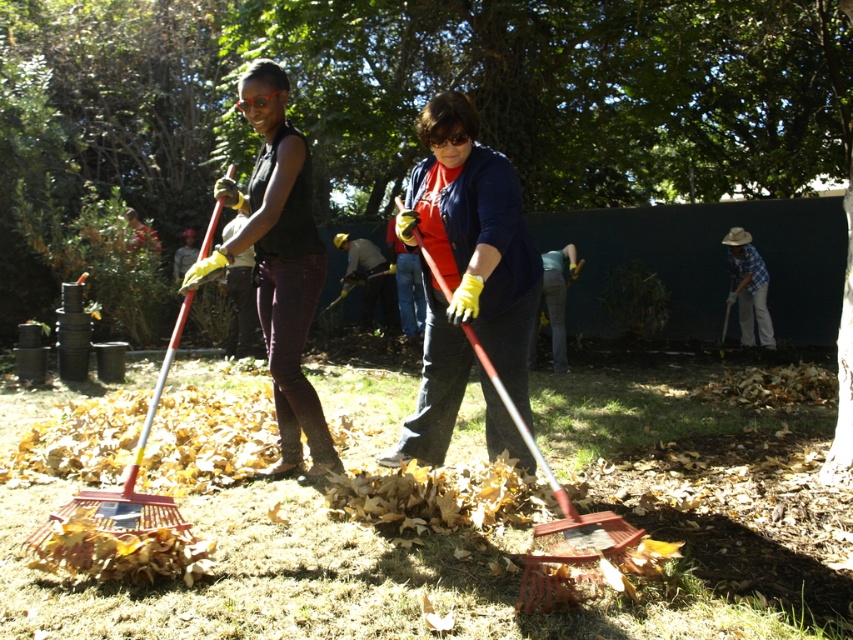
Between point (306, 291) and point (592, 534), which one is positioned in front?

Point (592, 534) is more forward.

Locate an element on the screen. The height and width of the screenshot is (640, 853). matte black shirt at center is located at coordinates (279, 262).

Can you confirm if red plastic shovel at center is smaller than dark gray fabric shirt at center?

Yes, red plastic shovel at center is smaller than dark gray fabric shirt at center.

How much distance is there between red plastic shovel at center and dark gray fabric shirt at center?

9.23 meters

What do you see at coordinates (543, 461) in the screenshot? I see `red plastic shovel at center` at bounding box center [543, 461].

The height and width of the screenshot is (640, 853). I want to click on red plastic shovel at center, so click(543, 461).

Who is more distant from viewer, (312, 221) or (753, 262)?

Positioned behind is point (753, 262).

Can you confirm if matte black shirt at center is positioned below blue plaid shirt at lower right?

Yes, matte black shirt at center is below blue plaid shirt at lower right.

Is point (289, 232) farther from camera compared to point (740, 308)?

No, (289, 232) is in front of (740, 308).

What are the coordinates of `matte black shirt at center` in the screenshot? It's located at (279, 262).